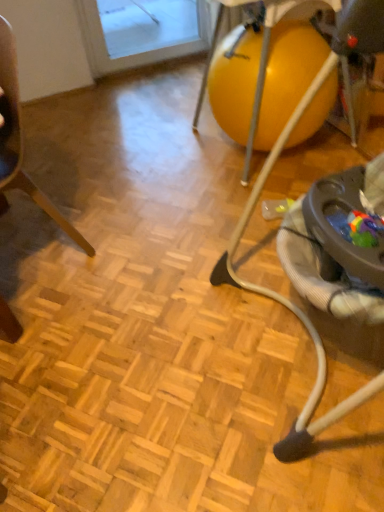
Identify the location of unoccupied region to the right of wooden chair at left. The width and height of the screenshot is (384, 512). (133, 238).